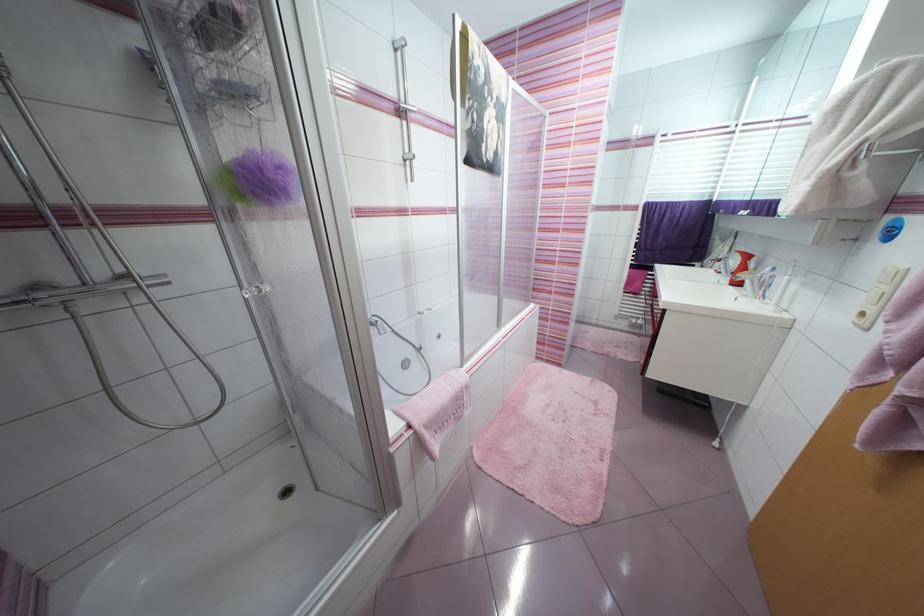
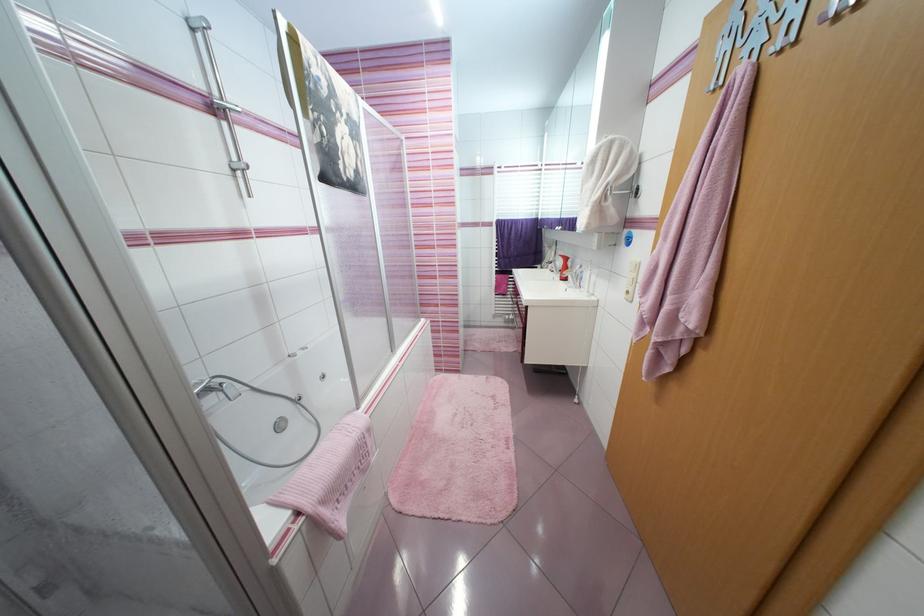
Locate, in the second image, the point that corresponds to point (720, 188) in the first image.

(543, 211)